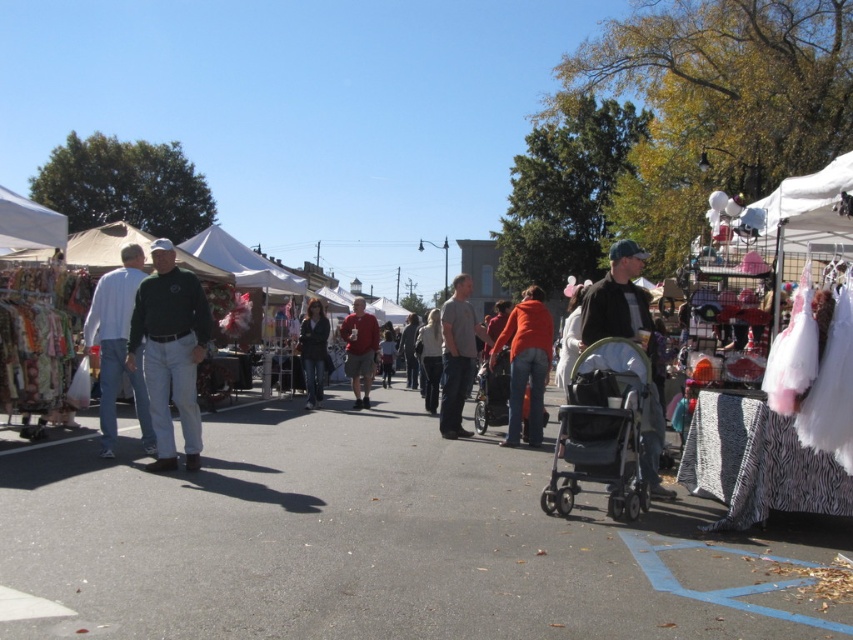
You are a customer at the market and want to buy both the green jersey at center and the dark gray jacket at center. However, your bag can only hold items that take up the same amount of space. Can you fit both items into your bag?

The green jersey at center occupies less space than the dark gray jacket at center, so they do not take up the same amount of space. Therefore, you cannot fit both items into your bag.

You are a customer at the outdoor market and want to buy a jacket. You see both the dark gray jacket at center and the matte green jacket at center. Which jacket is positioned lower in the display?

The dark gray jacket at center is positioned lower than the matte green jacket at center, so it is the one placed below.